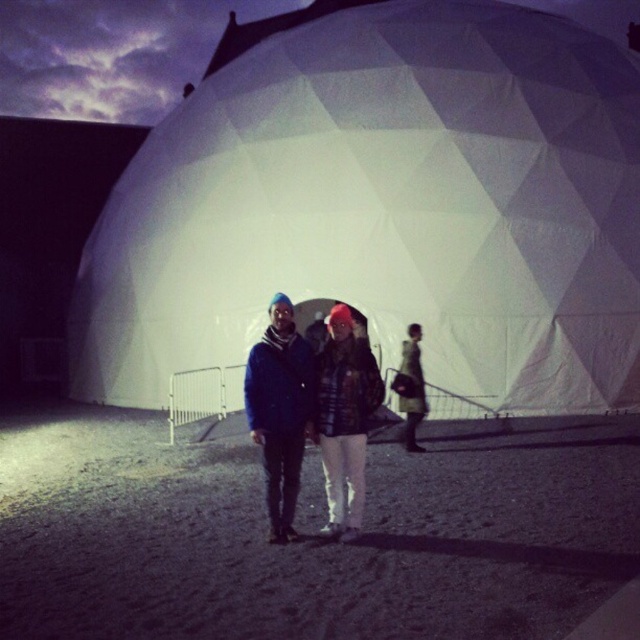
You are a photographer wanting to capture the white fabric dome at center and the dark blue jacket at center in a single shot. Given their height difference, which object will appear taller in the photo?

The white fabric dome at center will appear taller in the photo because it has a greater height compared to the dark blue jacket at center.

In the scene shown: You are standing in front of the geodesic dome at night. You see a dark blue jacket at center. Where is the dark blue jacket located in relation to the dome?

The dark blue jacket at center is located at point (280, 412) relative to the dome.